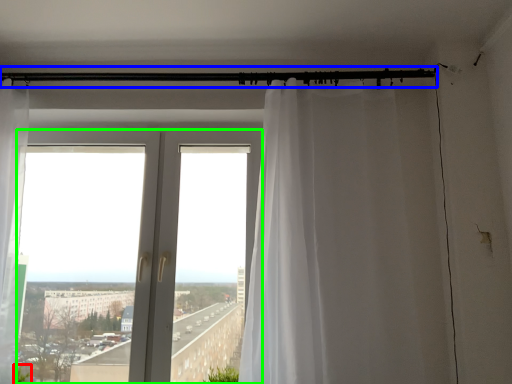
Question: Considering the real-world distances, which object is farthest from plant (highlighted by a red box)? beam (highlighted by a blue box) or window (highlighted by a green box)?

Choices:
 (A) beam
 (B) window

Answer: (A)